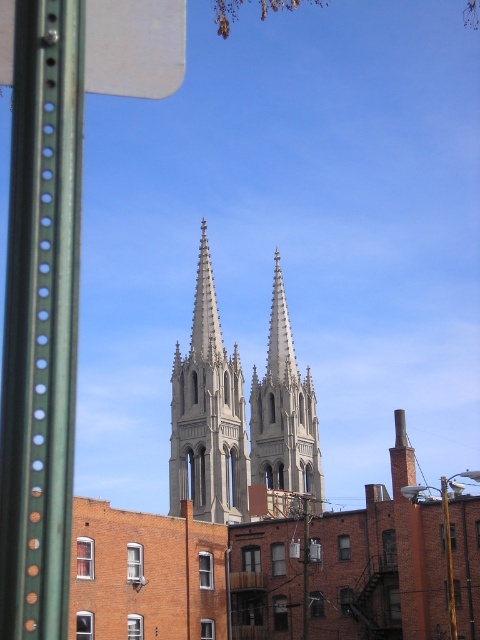
Question: Which point is closer to the camera?

Choices:
 (A) smooth gray stone spire at center
 (B) gray stone spire at center

Answer: (A)

Question: Among these points, which one is nearest to the camera?

Choices:
 (A) (280, 292)
 (B) (215, 508)

Answer: (B)

Question: Does gray stone spire at center appear on the right side of smooth gray stone spire at center?

Choices:
 (A) yes
 (B) no

Answer: (B)

Question: In this image, where is gray stone spire at center located relative to smooth gray stone spire at center?

Choices:
 (A) above
 (B) below

Answer: (A)

Question: From the image, what is the correct spatial relationship of gray stone spire at center in relation to smooth gray stone spire at center?

Choices:
 (A) below
 (B) above

Answer: (B)